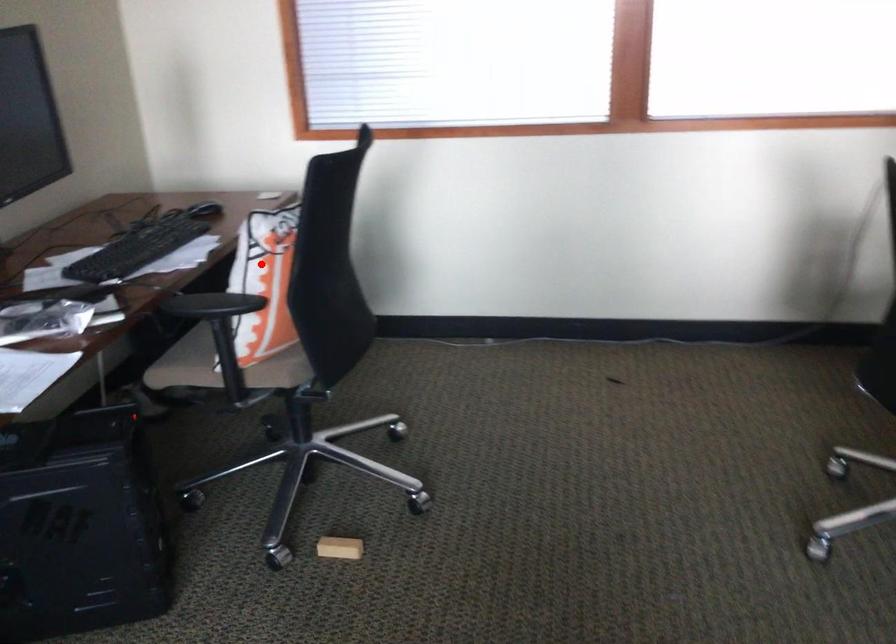
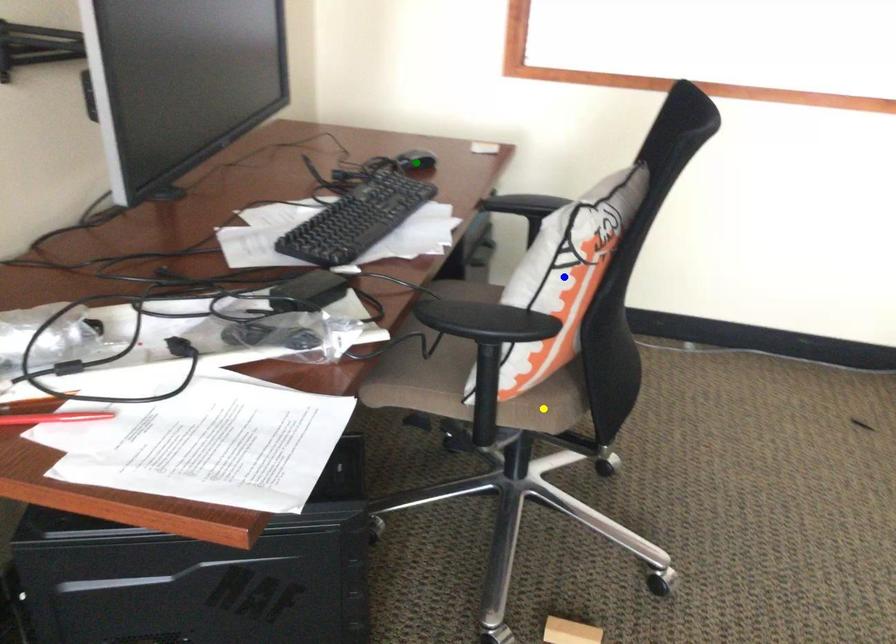
Question: I am providing you with two images of the same scene from different viewpoints. A red point is marked on the first image. You are given multiple points on the second image. Which spot in image 2 lines up with the point in image 1?

Choices:
 (A) green point
 (B) yellow point
 (C) blue point

Answer: (C)